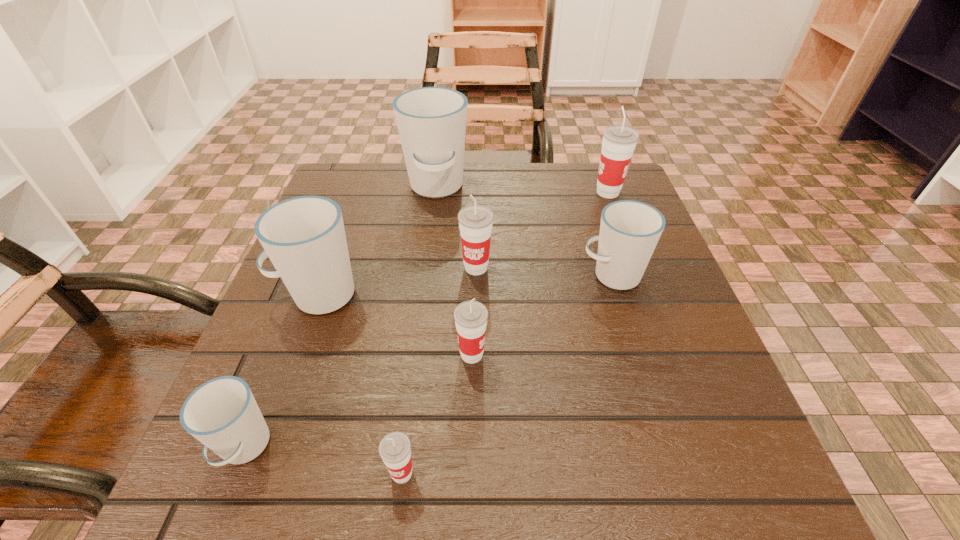
The width and height of the screenshot is (960, 540). Find the location of `the biggest white cup`. the biggest white cup is located at coordinates (431, 121).

The width and height of the screenshot is (960, 540). Identify the location of the third white cup from left to right. (431, 121).

Find the location of `the rightmost red cup`. the rightmost red cup is located at coordinates (619, 141).

This screenshot has height=540, width=960. In order to click on the farthest red cup in this screenshot , I will do `click(619, 141)`.

Where is `the second biggest red cup`? Image resolution: width=960 pixels, height=540 pixels. the second biggest red cup is located at coordinates (475, 221).

Identify the location of the third smallest white cup. (304, 237).

Locate an element on the screen. the sixth farthest object is located at coordinates (471, 316).

You are a GUI agent. You are given a task and a screenshot of the screen. Output one action in this format:
    pyautogui.click(x=<x>, y=<y>)
    Task: Click on the sixth farthest cup
    The image size is (960, 540).
    Given the screenshot: What is the action you would take?
    pyautogui.click(x=471, y=316)

Find the location of a particular element. the rightmost white cup is located at coordinates (629, 230).

At what (x,y) coordinates should I click in order to perform the action: click on the nearest white cup. Please return your answer as a coordinate pair (x, y). The width and height of the screenshot is (960, 540). Looking at the image, I should click on (222, 413).